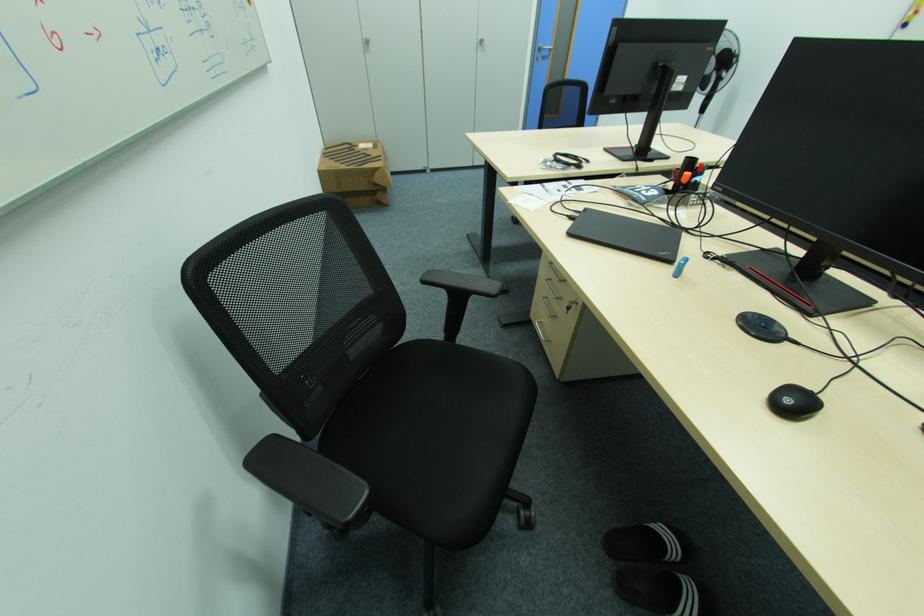
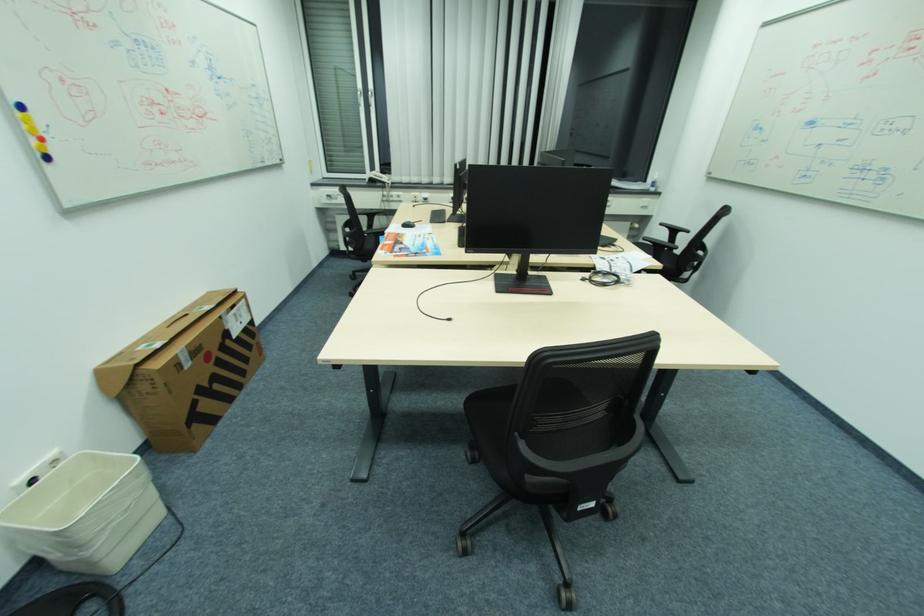
In the second image, find the point that corresponds to the point at 515,201 in the first image.

(657, 257)